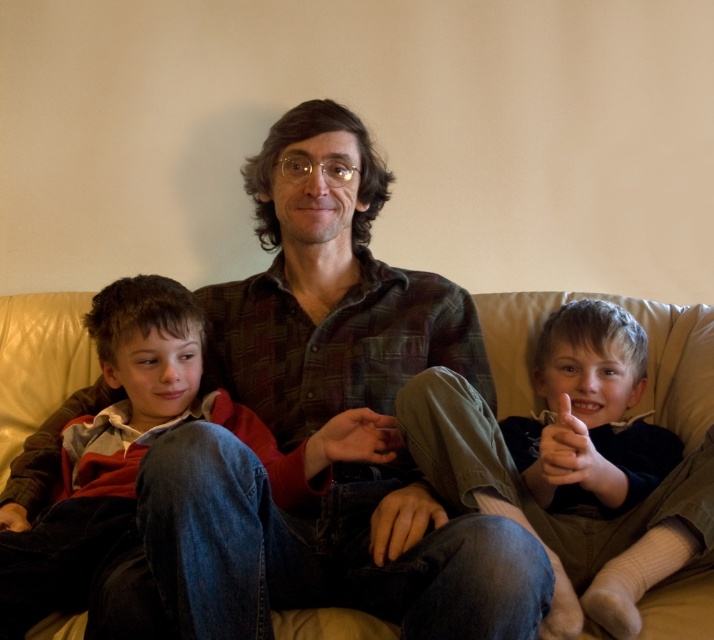
Which of these two, light brown cotton pants at right or beige leather couch at center, stands taller?

light brown cotton pants at right is taller.

Is point (580, 508) closer to camera compared to point (25, 365)?

That is True.

What do you see at coordinates (575, 486) in the screenshot? I see `light brown cotton pants at right` at bounding box center [575, 486].

Where is `light brown cotton pants at right`? light brown cotton pants at right is located at coordinates [x=575, y=486].